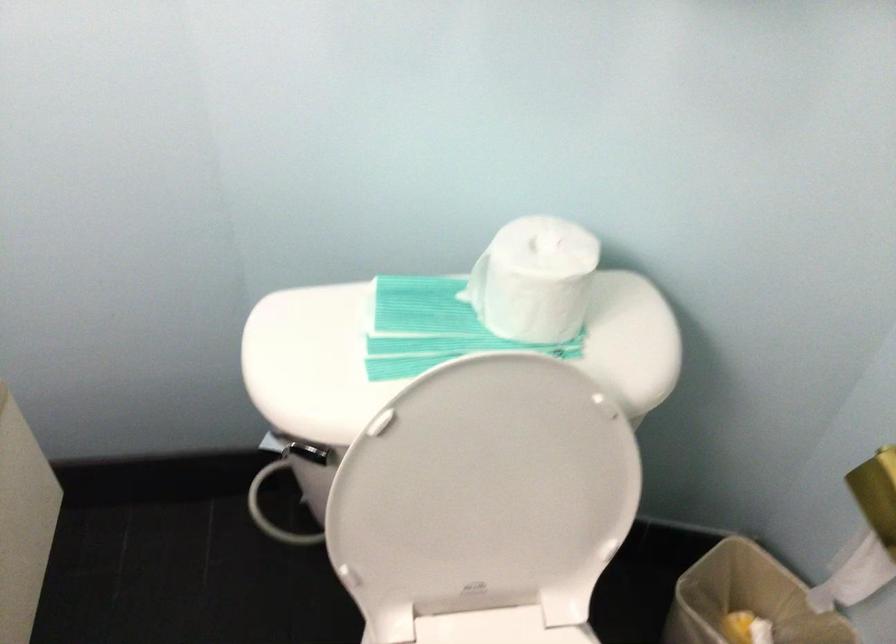
The width and height of the screenshot is (896, 644). What do you see at coordinates (497, 627) in the screenshot?
I see `the white toilet seat` at bounding box center [497, 627].